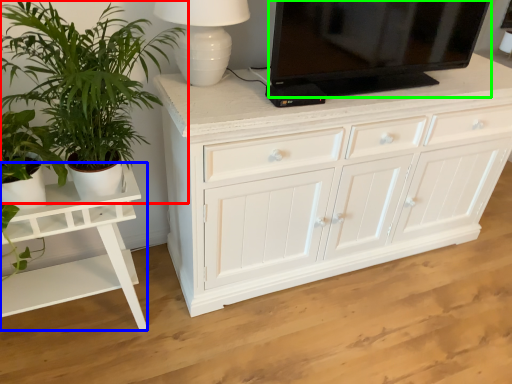
Question: Considering the real-world distances, which object is closest to houseplant (highlighted by a red box)? table (highlighted by a blue box) or television (highlighted by a green box).

Choices:
 (A) table
 (B) television

Answer: (A)